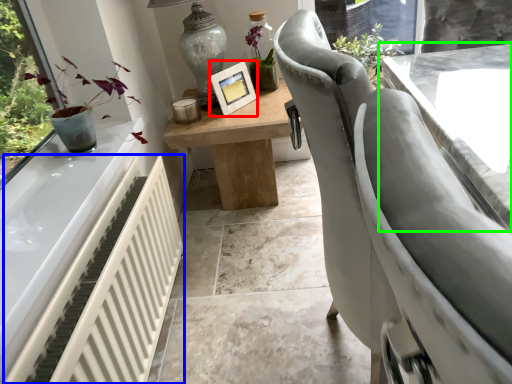
Question: Which object is positioned closest to picture frame (highlighted by a red box)? Select from radiator (highlighted by a blue box) and table (highlighted by a green box).

Choices:
 (A) radiator
 (B) table

Answer: (B)